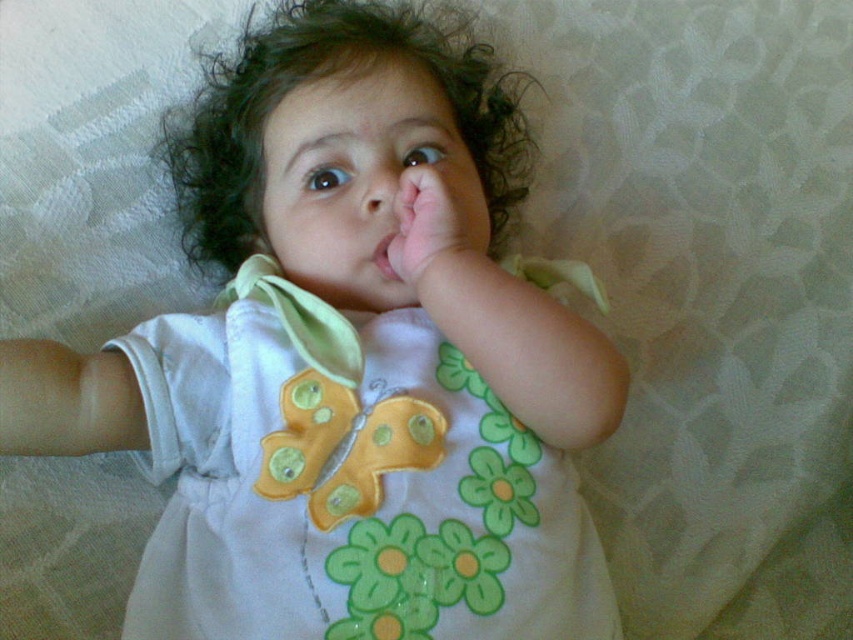
The height and width of the screenshot is (640, 853). Describe the element at coordinates (376, 189) in the screenshot. I see `smooth skin nose at center` at that location.

Does smooth skin nose at center have a greater height compared to pink smooth flesh at center?

Correct, smooth skin nose at center is much taller as pink smooth flesh at center.

At what (x,y) coordinates should I click in order to perform the action: click on smooth skin nose at center. Please return your answer as a coordinate pair (x, y). The width and height of the screenshot is (853, 640). Looking at the image, I should click on (376, 189).

Looking at this image, between white fabric dress at center and pink smooth hand at center, which one appears on the left side from the viewer's perspective?

white fabric dress at center

Is white fabric dress at center positioned before pink smooth hand at center?

Yes, it is in front of pink smooth hand at center.

Is point (337, 458) positioned in front of point (416, 198)?

Yes, point (337, 458) is in front of point (416, 198).

Where is `white fabric dress at center`? white fabric dress at center is located at coordinates (346, 368).

Who is lower down, white fabric dress at center or pink smooth flesh at center?

white fabric dress at center

Can you confirm if white fabric dress at center is smaller than pink smooth flesh at center?

Actually, white fabric dress at center might be larger than pink smooth flesh at center.

Which is in front, point (268, 349) or point (395, 269)?

Point (268, 349)

Identify the location of white fabric dress at center. (346, 368).